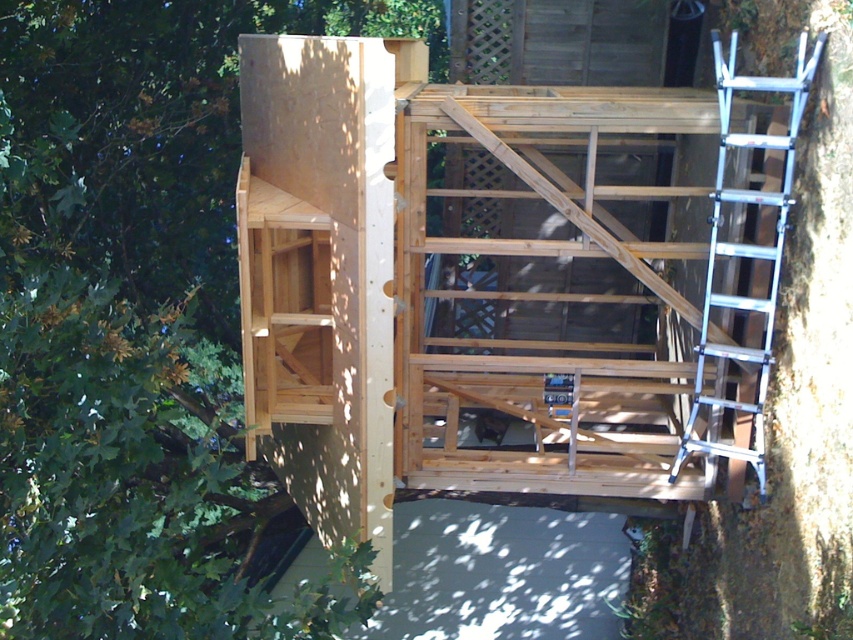
Which is behind, point (107, 227) or point (761, 259)?

Positioned behind is point (107, 227).

Can you confirm if green matte tree at upper left is smaller than silver metallic ladder at right?

No.

Who is more distant from viewer, [218,589] or [755,397]?

The point [755,397] is behind.

Find the location of `green matte tree at upper left`. green matte tree at upper left is located at coordinates (132, 314).